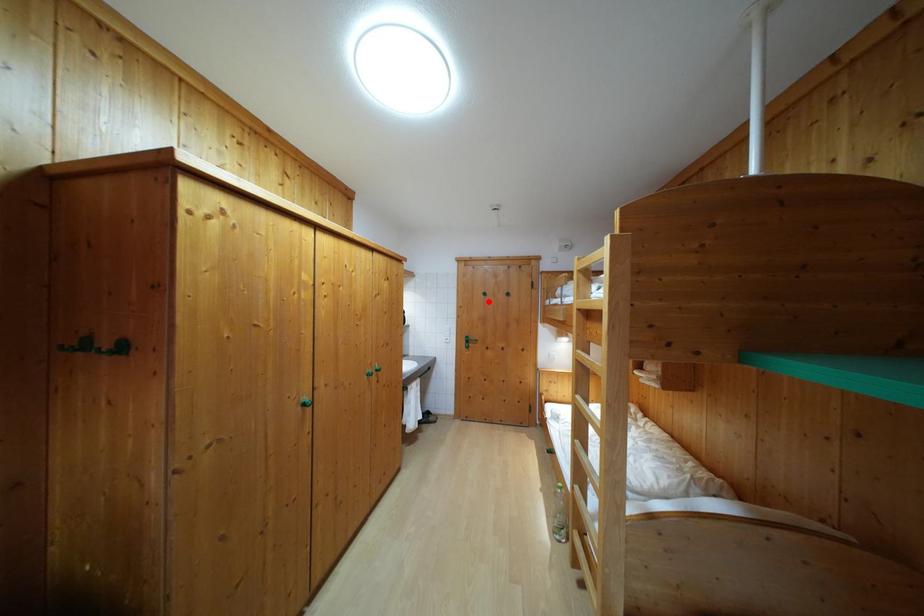
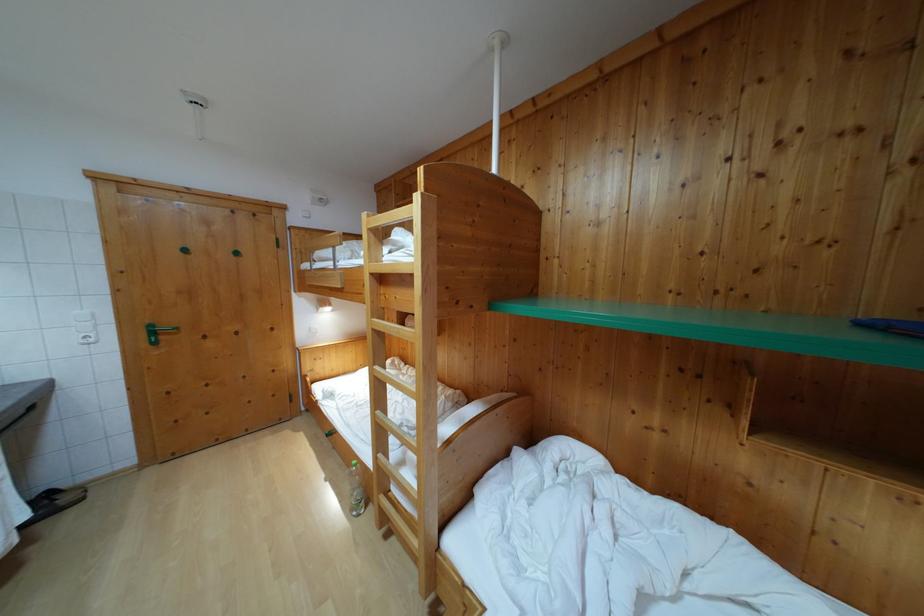
In the second image, find the point that corresponds to the highlighted location in the first image.

(189, 257)